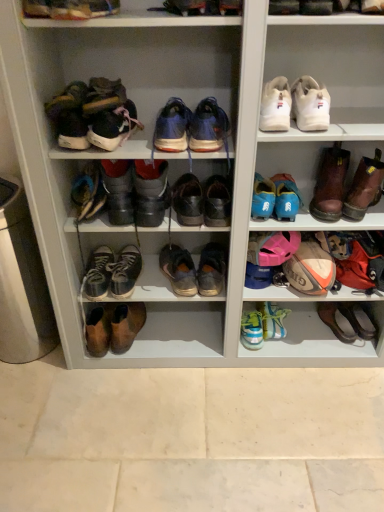
This screenshot has width=384, height=512. I want to click on free space that is to the left of brown leather shoe at lower right, positioned as the eleventh footwear in left-to-right order, so click(312, 339).